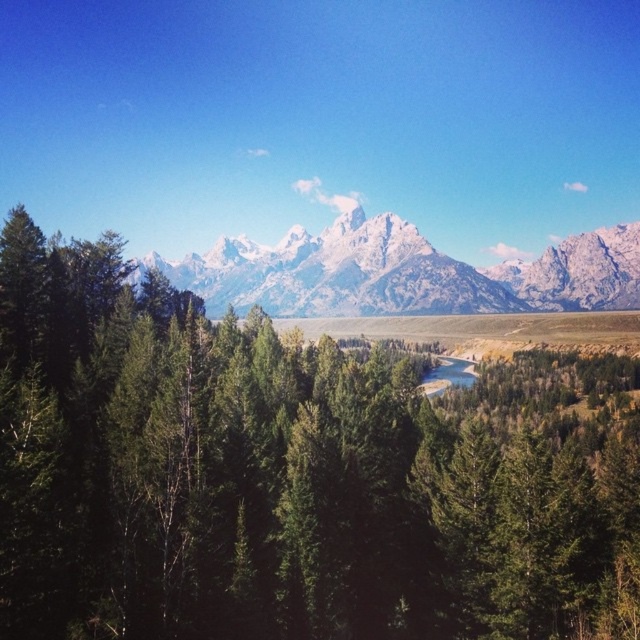
You are a hiker standing at the edge of the forest. You see a green matte tree at center and a clear blue water at center. Which object is wider in this scene?

The green matte tree at center is wider than the clear blue water at center according to the description.